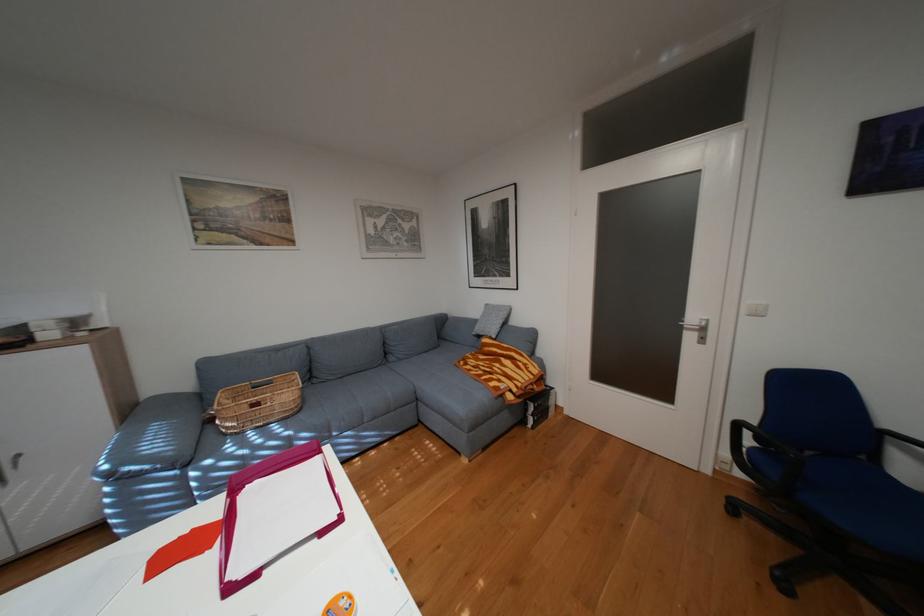
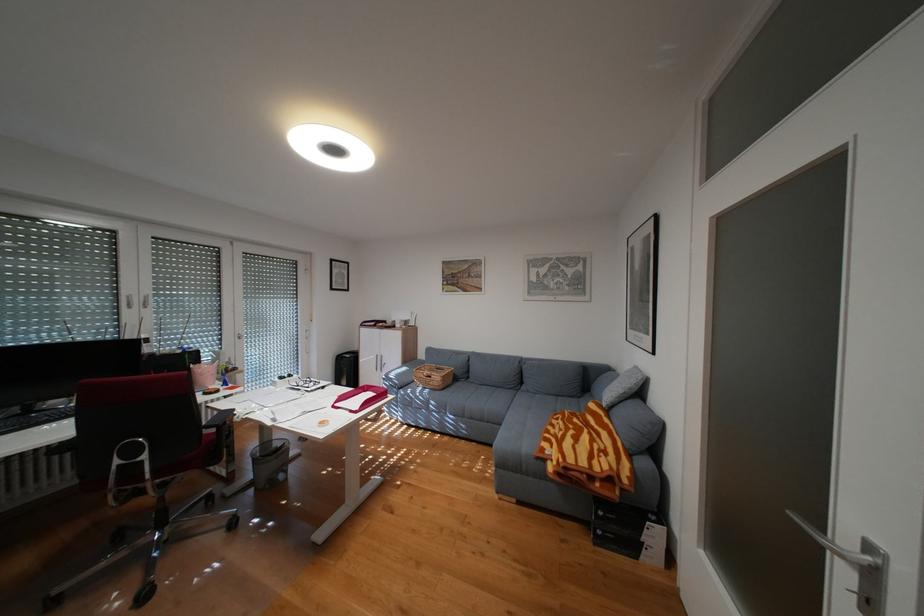
Locate, in the second image, the point that corresponds to pixel 512 379 in the first image.

(564, 445)